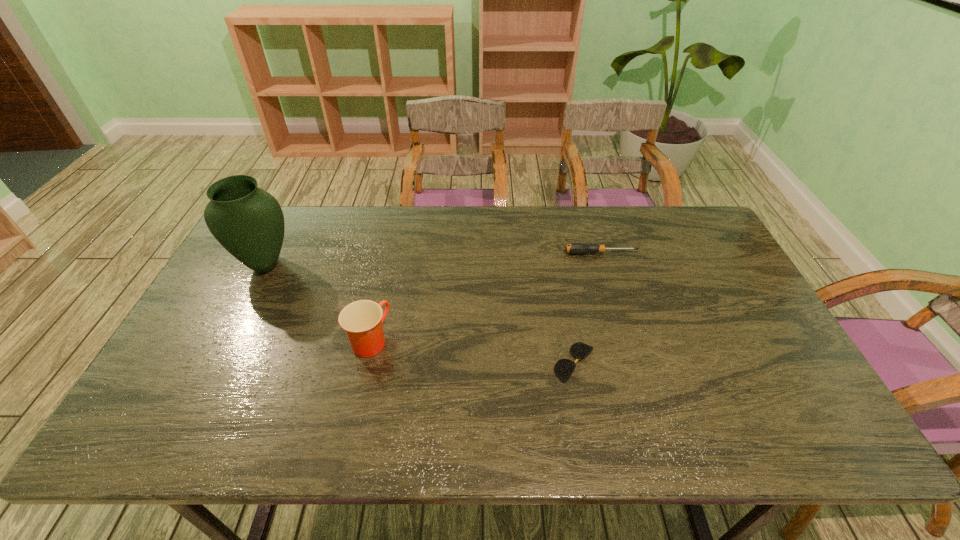
Where is `object situated at the far edge`? The image size is (960, 540). object situated at the far edge is located at coordinates (574, 248).

This screenshot has height=540, width=960. In order to click on object that is at the left edge in this screenshot , I will do `click(247, 221)`.

Find the location of `vacant space at the far edge`. vacant space at the far edge is located at coordinates (631, 213).

At what (x,y) coordinates should I click in order to perform the action: click on vacant space at the near edge of the desktop. Please return your answer as a coordinate pair (x, y). This screenshot has height=540, width=960. Looking at the image, I should click on (538, 416).

Image resolution: width=960 pixels, height=540 pixels. What are the coordinates of `free spot at the left edge of the desktop` in the screenshot? It's located at (163, 397).

At what (x,y) coordinates should I click in order to perform the action: click on vacant space at the right edge. Please return your answer as a coordinate pair (x, y). Looking at the image, I should click on click(x=731, y=323).

Where is `free space between the cup and the screwdriver`? free space between the cup and the screwdriver is located at coordinates (486, 297).

This screenshot has width=960, height=540. What are the coordinates of `vacant space in between the second shortest object and the leftmost object` in the screenshot? It's located at (433, 259).

At what (x,y) coordinates should I click in order to perform the action: click on vacant point located between the tallest object and the second object from left to right. Please return your answer as a coordinate pair (x, y). The width and height of the screenshot is (960, 540). Looking at the image, I should click on (318, 302).

Find the location of a particular element. vacant space that is in between the spectacles and the leftmost object is located at coordinates (420, 314).